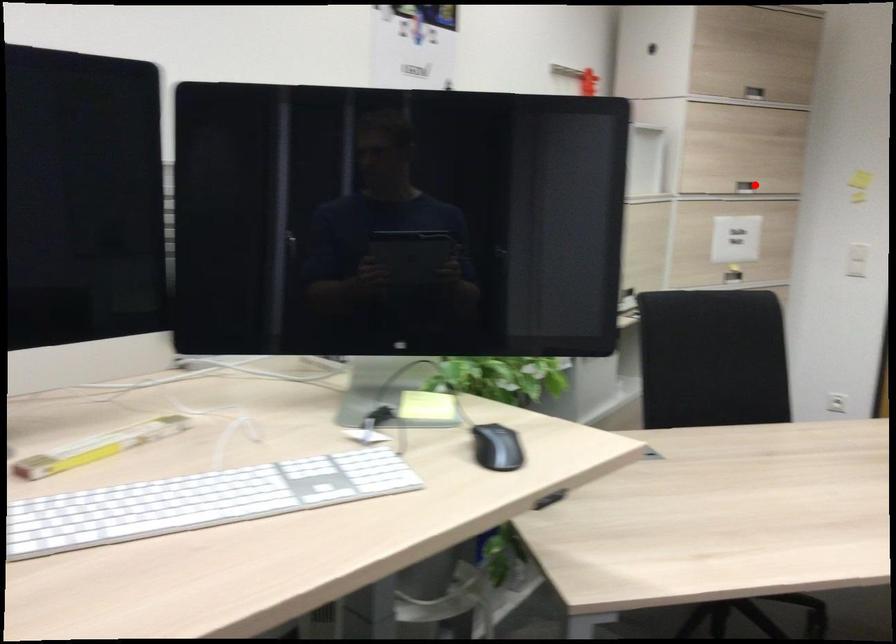
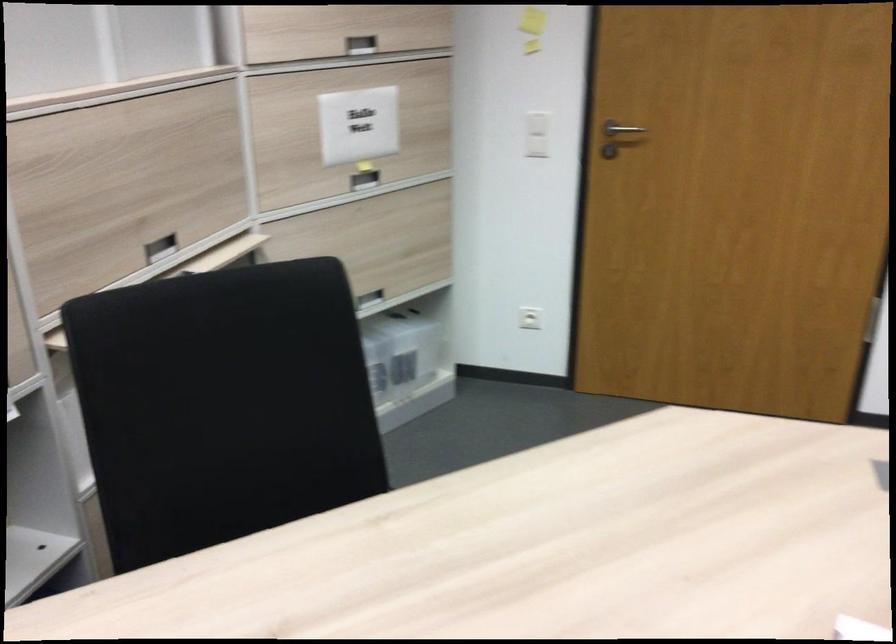
Question: A red point is marked in image1. In image2, is the corresponding 3D point closer to the camera or farther? Reply with the corresponding letter.

Choices:
 (A) The corresponding 3D point is closer.
 (B) The corresponding 3D point is farther.

Answer: (A)